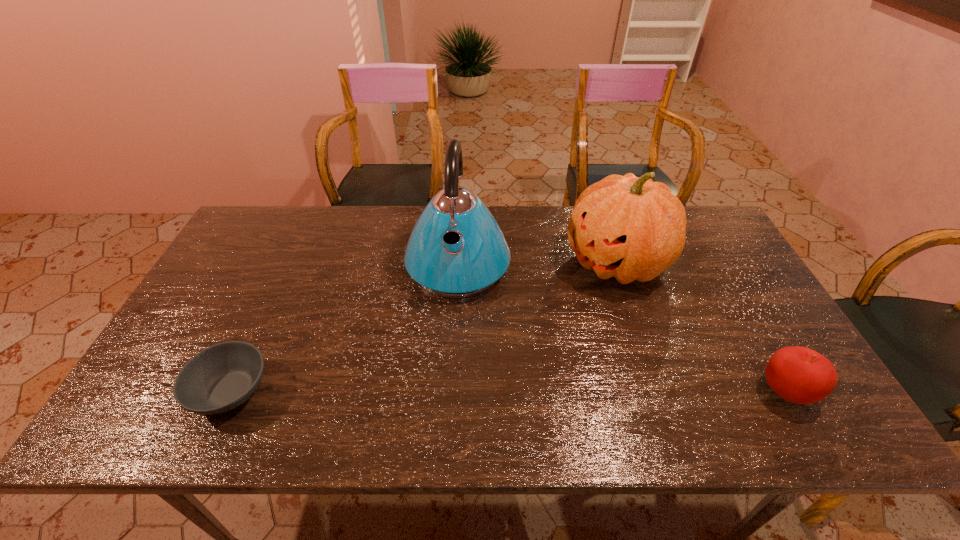
This screenshot has height=540, width=960. In order to click on free spot on the desktop that is between the leftmost object and the third tallest object and is positioned at the spout of the kettle in this screenshot , I will do `click(447, 391)`.

You are a GUI agent. You are given a task and a screenshot of the screen. Output one action in this format:
    pyautogui.click(x=<x>, y=<y>)
    Task: Click on the free space on the desktop that is between the leftmost object and the third tallest object and is positioned on the carved face of the third object from left to right
    
    Given the screenshot: What is the action you would take?
    pyautogui.click(x=429, y=391)